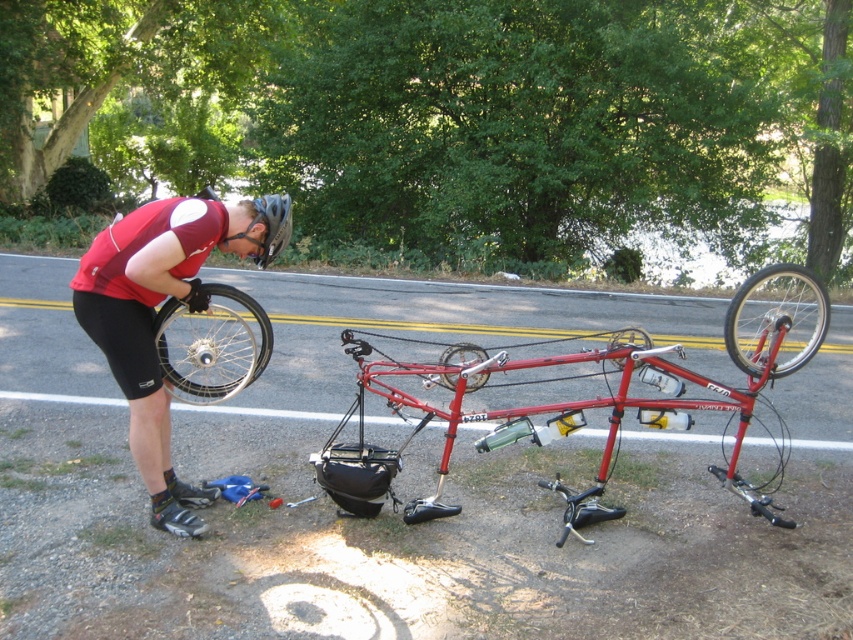
Question: Which is farther from the red matte bicycle at center?

Choices:
 (A) matte black shorts at left
 (B) metallic silver wheel at right
 (C) shiny silver rim at left

Answer: (C)

Question: Does matte black shorts at left appear on the right side of matte black tire at center?

Choices:
 (A) no
 (B) yes

Answer: (A)

Question: Which point appears farthest from the camera in this image?

Choices:
 (A) (251, 308)
 (B) (282, 241)
 (C) (726, 394)
 (D) (805, 333)

Answer: (D)

Question: Is shiny silver rim at left further to camera compared to metallic silver wheel at center?

Choices:
 (A) no
 (B) yes

Answer: (A)

Question: In this image, where is shiny silver rim at left located relative to metallic silver wheel at center?

Choices:
 (A) above
 (B) below

Answer: (A)

Question: Which of the following is the farthest from the observer?

Choices:
 (A) (138, 355)
 (B) (451, 388)

Answer: (B)